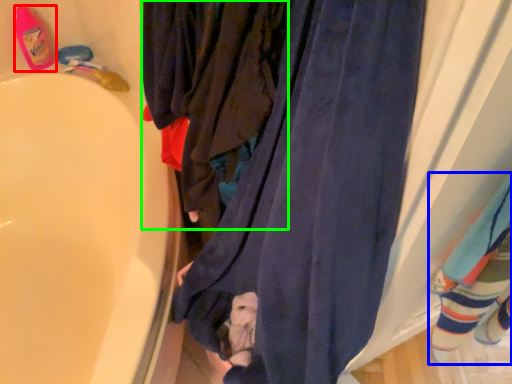
Question: Which is farther away from footwear (highlighted by a red box)? bath towel (highlighted by a blue box) or clothing (highlighted by a green box)?

Choices:
 (A) bath towel
 (B) clothing

Answer: (A)